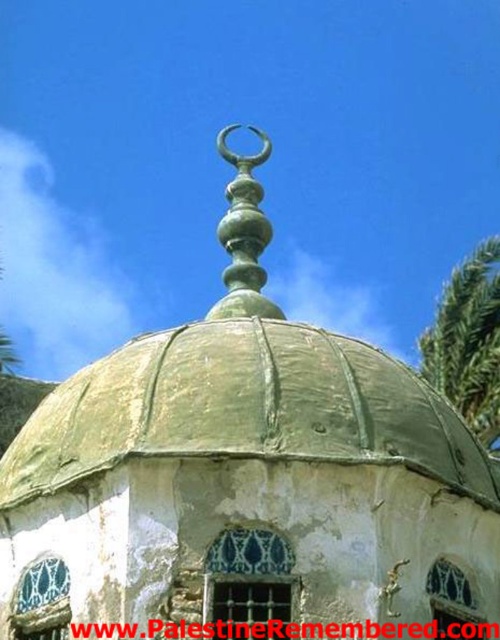
Is the position of green leafy palm tree at right less distant than that of green polished metal spire at center?

That is False.

Can you confirm if green leafy palm tree at right is positioned to the left of green polished metal spire at center?

No, green leafy palm tree at right is not to the left of green polished metal spire at center.

At what (x,y) coordinates should I click in order to perform the action: click on green leafy palm tree at right. Please return your answer as a coordinate pair (x, y). The height and width of the screenshot is (640, 500). Looking at the image, I should click on (468, 340).

Locate an element on the screen. green leafy palm tree at right is located at coordinates (468, 340).